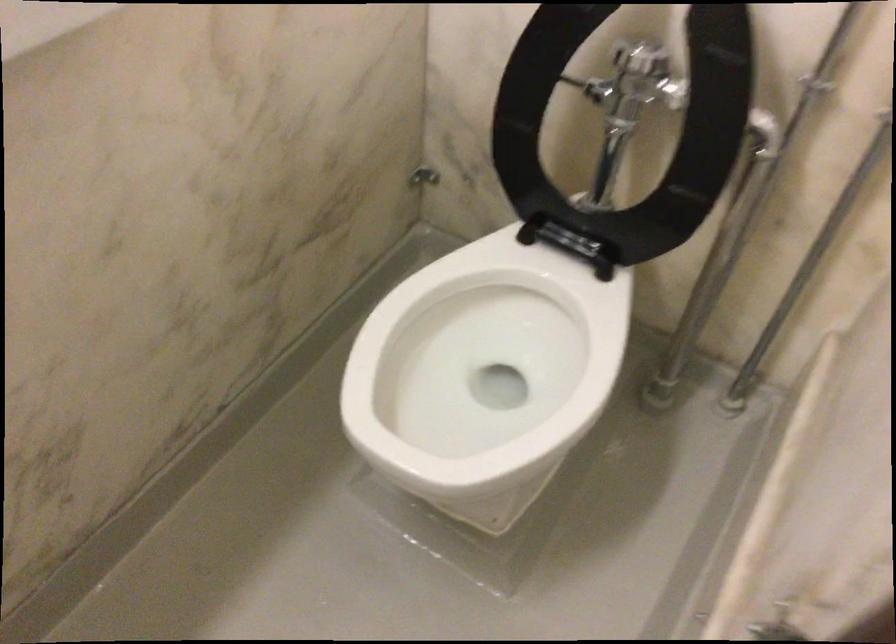
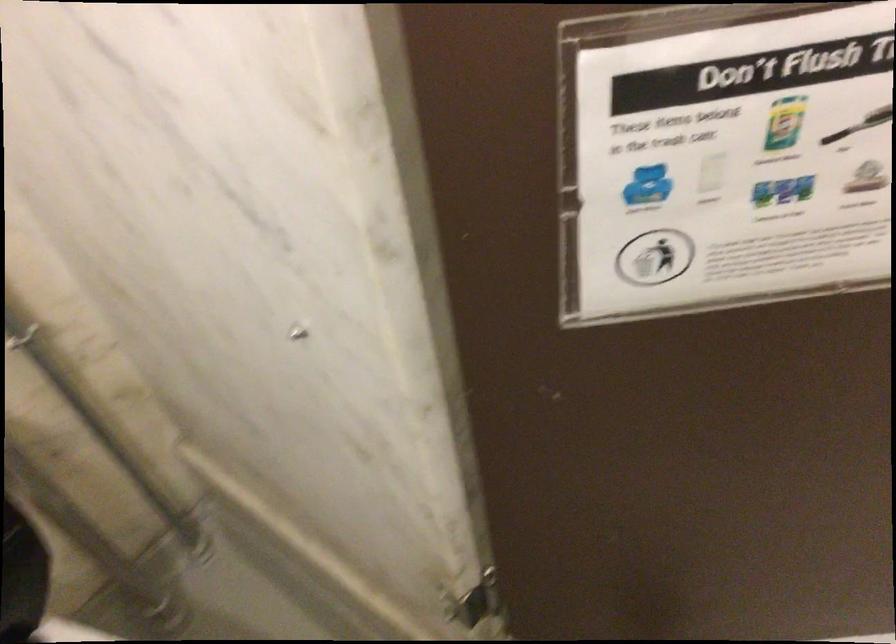
The images are taken continuously from a first-person perspective. In which direction is your viewpoint rotating?

The camera rotated toward right-down.